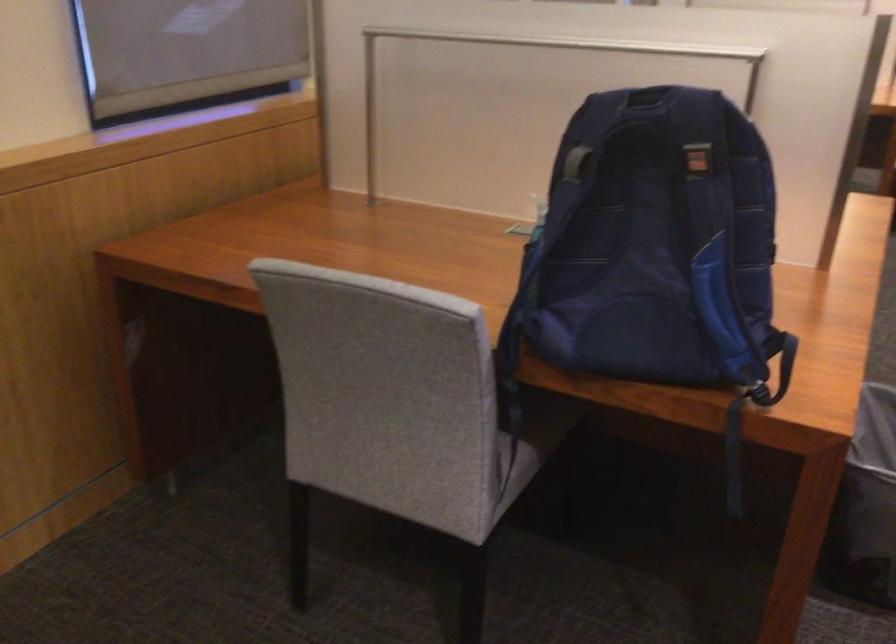
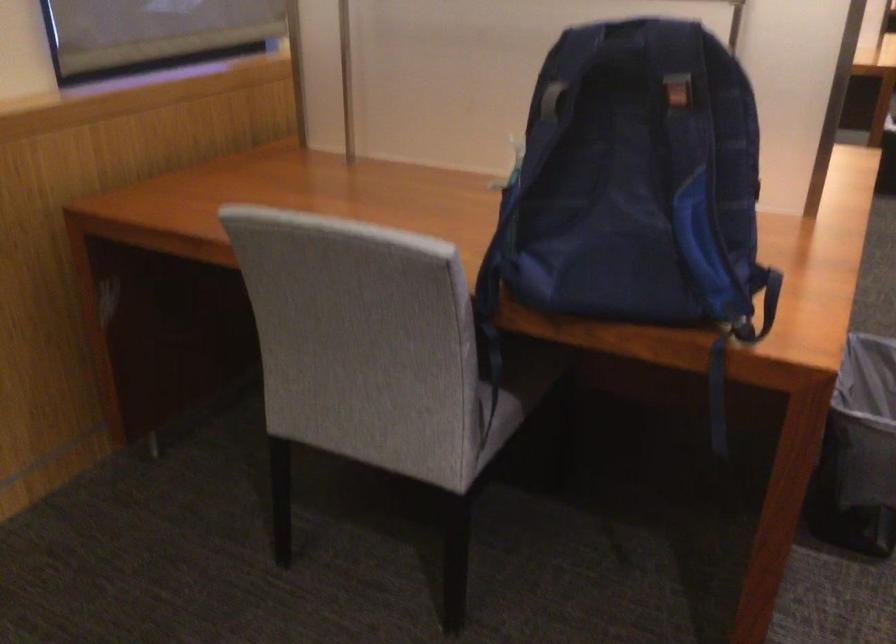
Where in the second image is the point corresponding to the point at 695,163 from the first image?

(677, 93)